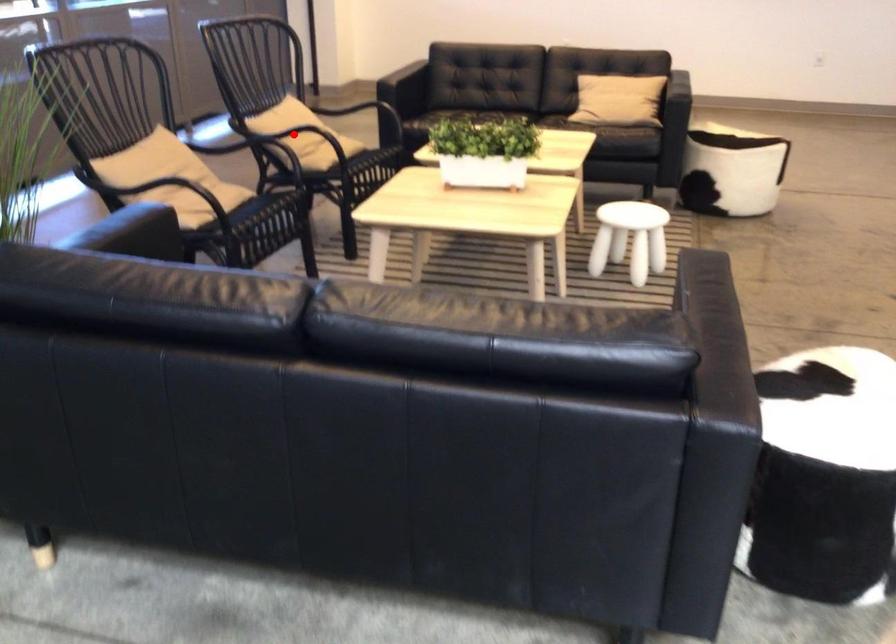
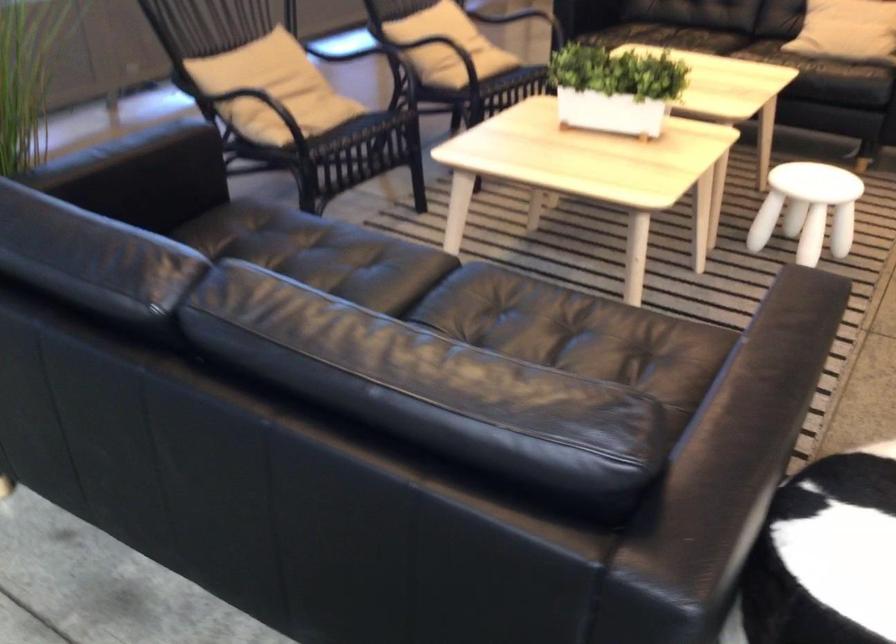
Question: I am providing you with two images of the same scene from different viewpoints. Given a red point in image1, look at the same physical point in image2. Is it:

Choices:
 (A) Closer to the viewpoint
 (B) Farther from the viewpoint

Answer: (A)